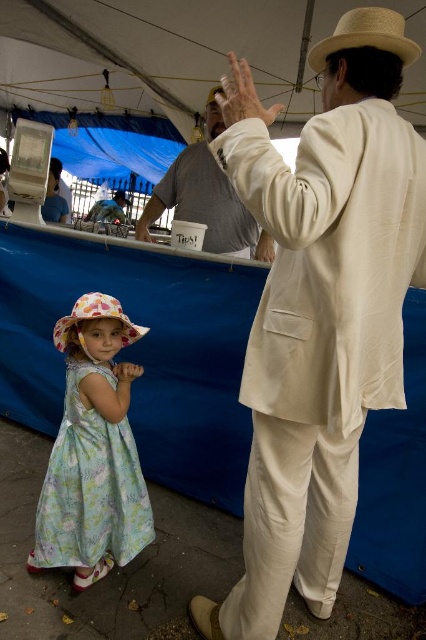
You are setting up a booth at an event and need to place a decorative banner between the light gray cotton shirt at upper center and the natural straw cowboy hat at upper right. Based on their widths, which object should the banner be closer to?

The banner should be closer to the light gray cotton shirt at upper center because it might be wider than the natural straw cowboy hat at upper right.